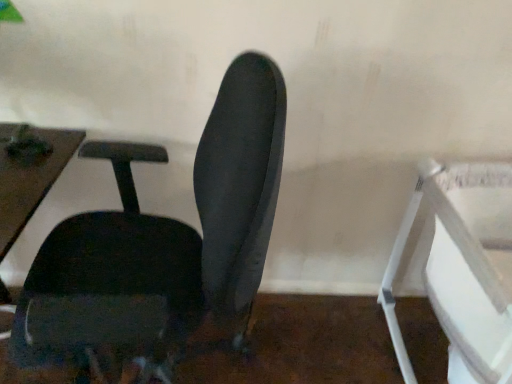
Question: Does point (502, 173) appear closer or farther from the camera than point (265, 61)?

Choices:
 (A) farther
 (B) closer

Answer: (A)

Question: Would you say white plastic feeding chair at right is to the left or to the right of matte black chair at center in the picture?

Choices:
 (A) right
 (B) left

Answer: (A)

Question: Looking at their shapes, would you say white plastic feeding chair at right is wider or thinner than matte black chair at center?

Choices:
 (A) thin
 (B) wide

Answer: (B)

Question: Is matte black chair at center inside the boundaries of white plastic feeding chair at right, or outside?

Choices:
 (A) inside
 (B) outside

Answer: (B)

Question: From the image's perspective, is matte black chair at center located above or below white plastic feeding chair at right?

Choices:
 (A) below
 (B) above

Answer: (B)

Question: Is matte black chair at center bigger or smaller than white plastic feeding chair at right?

Choices:
 (A) big
 (B) small

Answer: (A)

Question: From a real-world perspective, is matte black chair at center physically located above or below white plastic feeding chair at right?

Choices:
 (A) above
 (B) below

Answer: (A)